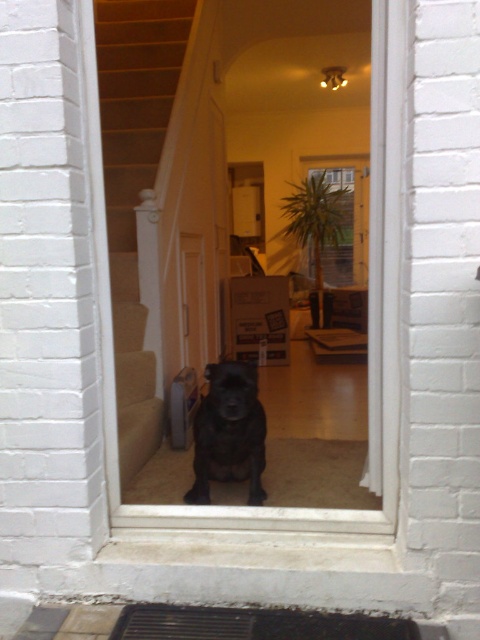
Question: Is carpeted stairs at center below dark brown textured mat at lower center?

Choices:
 (A) no
 (B) yes

Answer: (A)

Question: Does carpeted stairs at center lie in front of dark brown textured mat at lower center?

Choices:
 (A) yes
 (B) no

Answer: (B)

Question: Is dark brown textured mat at lower center to the left of shiny black dog at center from the viewer's perspective?

Choices:
 (A) yes
 (B) no

Answer: (B)

Question: Which of the following is the farthest from the observer?

Choices:
 (A) shiny black dog at center
 (B) dark brown textured mat at lower center

Answer: (A)

Question: Which point is closer to the camera?

Choices:
 (A) (210, 609)
 (B) (237, 394)
 (C) (163, 129)

Answer: (A)

Question: Which of the following is the farthest from the observer?

Choices:
 (A) carpeted stairs at center
 (B) dark brown textured mat at lower center

Answer: (A)